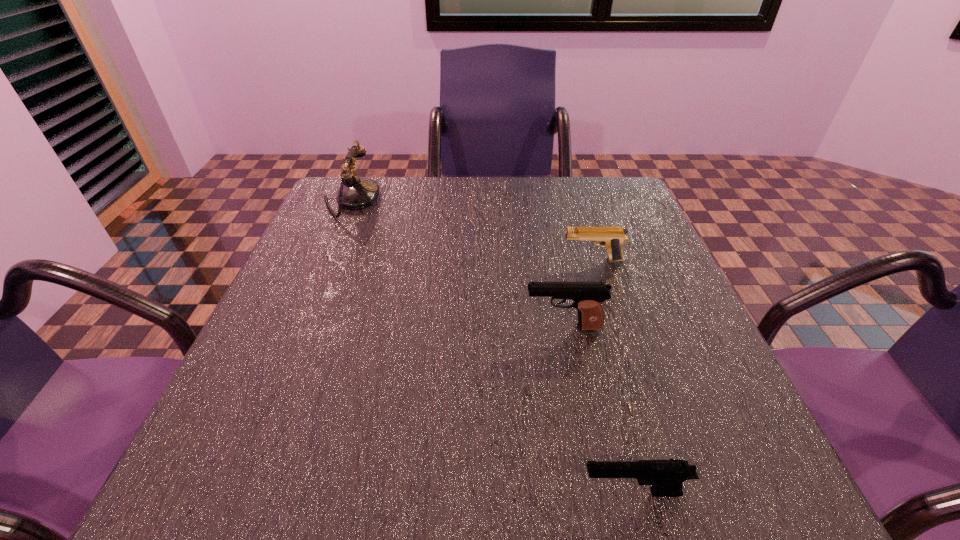
Where is `the leftmost object`? The width and height of the screenshot is (960, 540). the leftmost object is located at coordinates (356, 193).

Identify the location of the farthest object. The width and height of the screenshot is (960, 540). (356, 193).

Where is `the third shortest object`? This screenshot has height=540, width=960. the third shortest object is located at coordinates (588, 297).

Where is `the second nearest object`? the second nearest object is located at coordinates (588, 297).

The image size is (960, 540). What are the coordinates of `the second farthest object` in the screenshot? It's located at (612, 238).

Identify the location of the nearest object. Image resolution: width=960 pixels, height=540 pixels. (666, 476).

Locate an element on the screen. free region located 0.280m on the dial of the leftmost object is located at coordinates (482, 200).

At what (x,y) coordinates should I click in order to perform the action: click on free location located at the barrel of the second tallest object. Please return your answer as a coordinate pair (x, y). The image size is (960, 540). Looking at the image, I should click on (409, 327).

At what (x,y) coordinates should I click in order to perform the action: click on blank space located at the barrel of the second tallest object. Please return your answer as a coordinate pair (x, y). Looking at the image, I should click on (388, 327).

The width and height of the screenshot is (960, 540). Find the location of `free location located 0.110m at the barrel of the second tallest object`. free location located 0.110m at the barrel of the second tallest object is located at coordinates (467, 327).